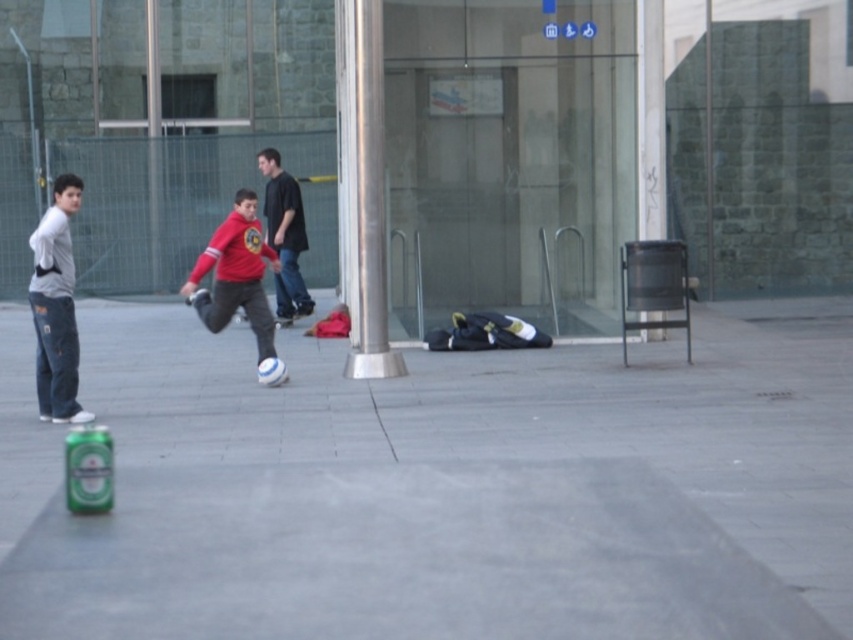
Question: Can you confirm if denim pants at left is wider than matte black shirt at center?

Choices:
 (A) no
 (B) yes

Answer: (A)

Question: Which point is closer to the camera?

Choices:
 (A) matte red hoodie at center
 (B) denim pants at left
 (C) matte black shirt at center

Answer: (B)

Question: Which point is closer to the camera taking this photo?

Choices:
 (A) (207, 250)
 (B) (51, 221)
 (C) (68, 476)
 (D) (770, 396)

Answer: (C)

Question: Does matte black shirt at center appear on the right side of green matte can at lower left?

Choices:
 (A) yes
 (B) no

Answer: (A)

Question: Does gray concrete pavement at center come in front of green matte can at lower left?

Choices:
 (A) yes
 (B) no

Answer: (A)

Question: Which is farther from the gray concrete pavement at center?

Choices:
 (A) matte red hoodie at center
 (B) matte black shirt at center
 (C) denim pants at left
 (D) green matte can at lower left

Answer: (B)